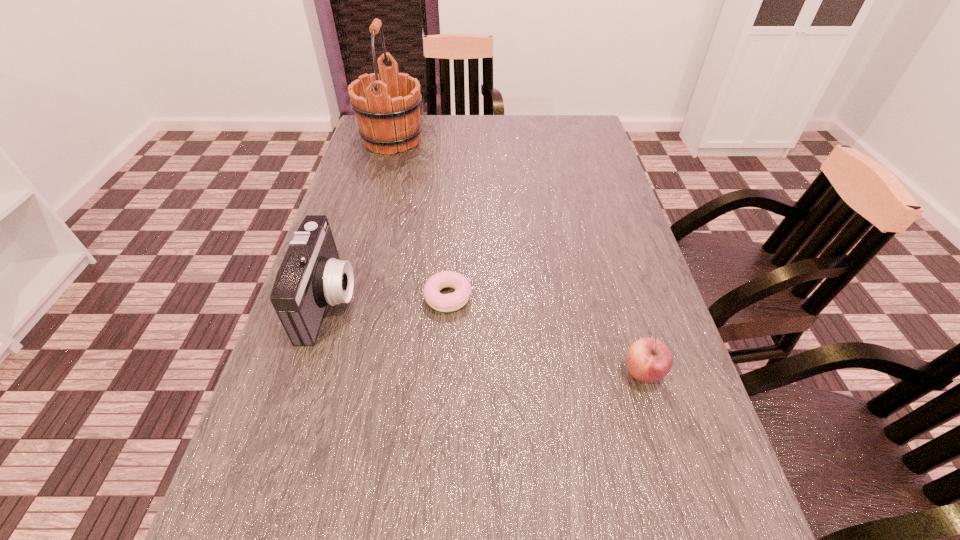
Locate an element on the screen. Image resolution: width=960 pixels, height=540 pixels. blank area located 0.200m on the front of the doughnut is located at coordinates (442, 403).

At what (x,y) coordinates should I click in order to perform the action: click on object located in the far edge section of the desktop. Please return your answer as a coordinate pair (x, y). The height and width of the screenshot is (540, 960). Looking at the image, I should click on (387, 104).

Identify the location of wine bucket at the left edge. Image resolution: width=960 pixels, height=540 pixels. (387, 104).

Find the location of a particular element. camcorder that is positioned at the left edge is located at coordinates (311, 276).

Where is `object present at the right edge`? The height and width of the screenshot is (540, 960). object present at the right edge is located at coordinates (648, 360).

Locate an element on the screen. This screenshot has width=960, height=540. object positioned at the far left corner is located at coordinates (387, 104).

In the image, there is a desktop. Where is `free space at the far edge`? free space at the far edge is located at coordinates (515, 133).

The width and height of the screenshot is (960, 540). In order to click on free spot at the left edge of the desktop in this screenshot , I will do `click(335, 244)`.

In order to click on vacant area at the right edge in this screenshot , I will do `click(633, 312)`.

You are a GUI agent. You are given a task and a screenshot of the screen. Output one action in this format:
    pyautogui.click(x=<x>, y=<y>)
    Task: Click on the vacant area at the far left corner of the desktop
    This screenshot has height=540, width=960.
    Given the screenshot: What is the action you would take?
    pyautogui.click(x=367, y=148)